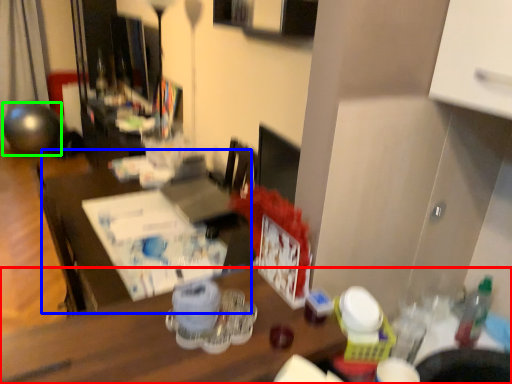
Question: Which object is positioned farthest from desk (highlighted by a red box)? Select from table (highlighted by a blue box) and ball (highlighted by a green box).

Choices:
 (A) table
 (B) ball

Answer: (B)